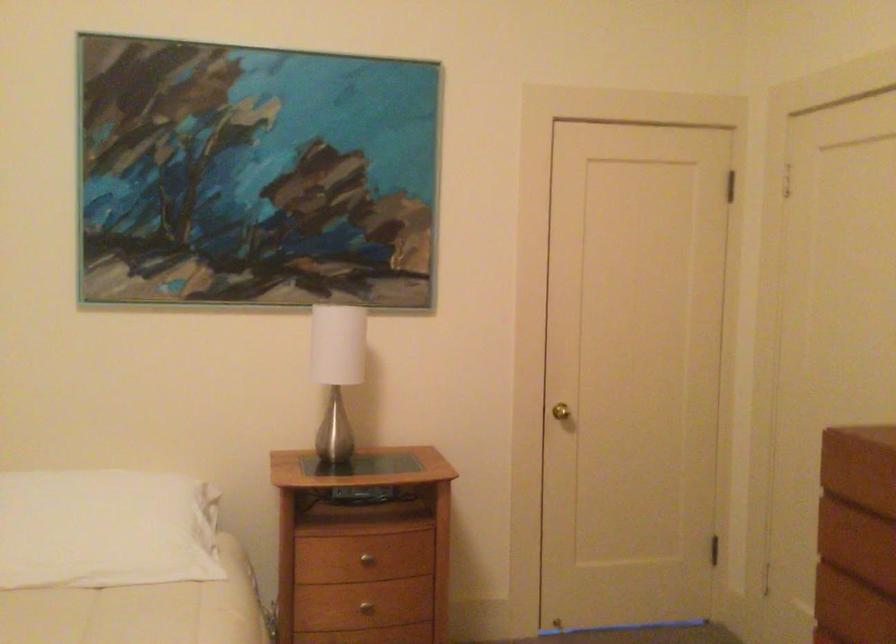
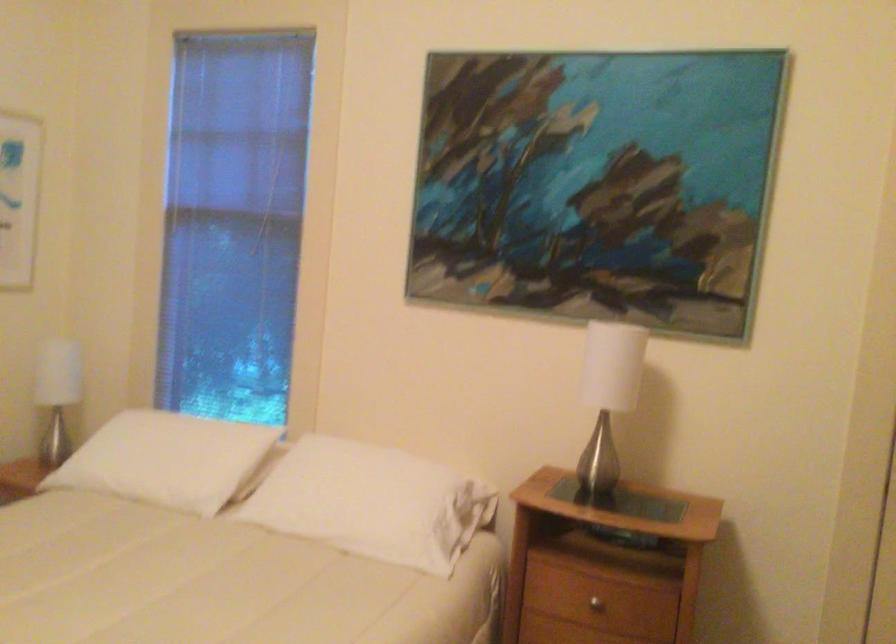
Where in the second image is the point corresponding to (110,529) from the first image?

(373, 502)